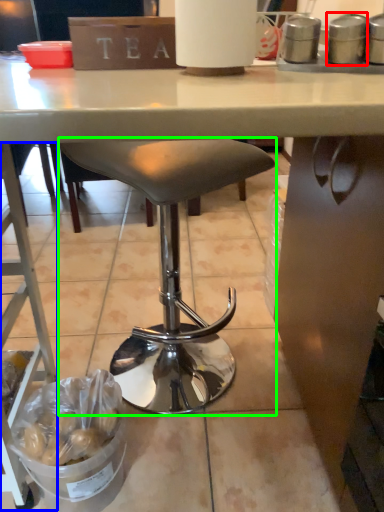
Question: Which is nearer to the appliance (highlighted by a red box)? ladder (highlighted by a blue box) or stool (highlighted by a green box).

Choices:
 (A) ladder
 (B) stool

Answer: (B)